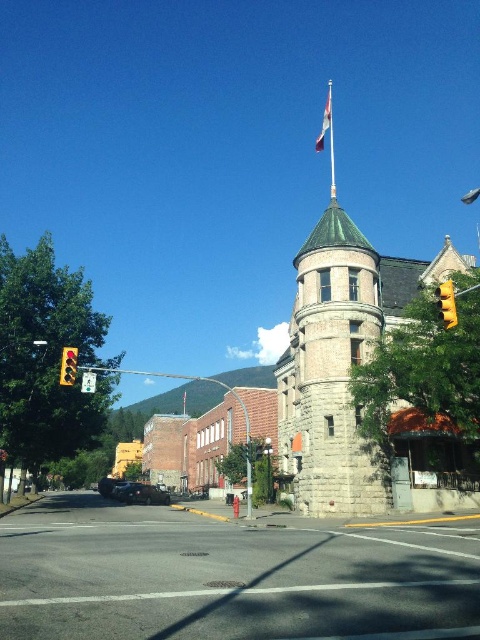
You are a pedestrian standing at the intersection and want to cross the street. The traffic light is yellow plastic traffic light at left. The car you see is shiny black sedan at center. If the car is moving towards you at 10 meters per second, how many seconds do you have before it reaches the traffic light?

The shiny black sedan at center is 34.80 meters away from the yellow plastic traffic light at left. At a speed of 10 meters per second, it will take the car 3.48 seconds to reach the traffic light.